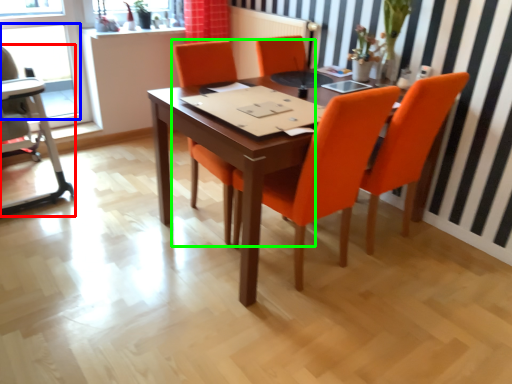
Question: Considering the real-world distances, which object is farthest from armchair (highlighted by a red box)? window (highlighted by a blue box) or chair (highlighted by a green box)?

Choices:
 (A) window
 (B) chair

Answer: (B)